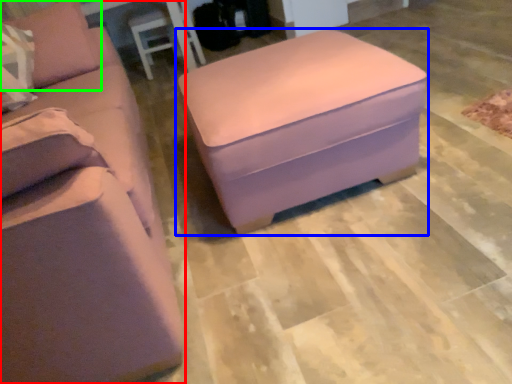
Question: Which is nearer to the studio couch (highlighted by a red box)? table (highlighted by a blue box) or pillow (highlighted by a green box).

Choices:
 (A) table
 (B) pillow

Answer: (B)